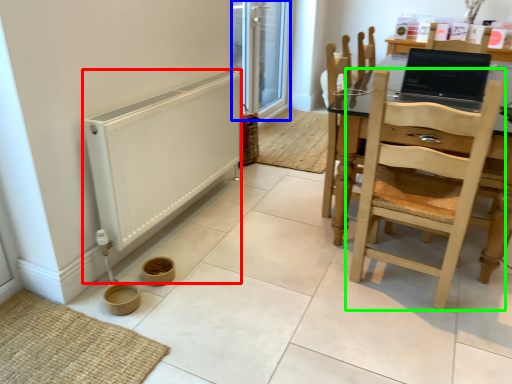
Question: Considering the real-world distances, which object is closest to heater (highlighted by a red box)? screen door (highlighted by a blue box) or chair (highlighted by a green box).

Choices:
 (A) screen door
 (B) chair

Answer: (B)